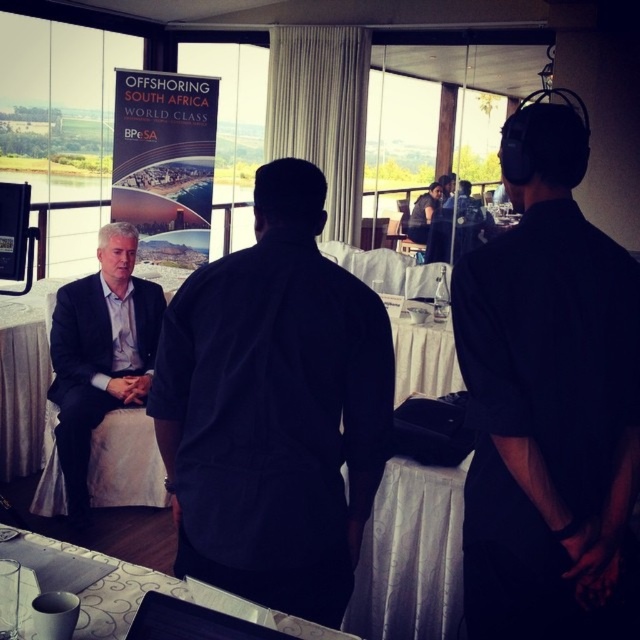
Looking at this image, can you confirm if black short-sleeved shirt at center is smaller than white fabric table at lower center?

Actually, black short-sleeved shirt at center might be larger than white fabric table at lower center.

Is black short-sleeved shirt at center above white fabric table at lower center?

Yes.

Image resolution: width=640 pixels, height=640 pixels. What do you see at coordinates (548, 403) in the screenshot?
I see `black short-sleeved shirt at center` at bounding box center [548, 403].

Locate an element on the screen. This screenshot has width=640, height=640. black short-sleeved shirt at center is located at coordinates (548, 403).

Where is `white fabric table at lower center`? white fabric table at lower center is located at coordinates click(112, 589).

Which of these two, white fabric table at lower center or matte black shirt at center, stands taller?

matte black shirt at center is taller.

Is point (310, 636) closer to camera compared to point (420, 211)?

Yes, it is in front of point (420, 211).

Locate an element on the screen. Image resolution: width=640 pixels, height=640 pixels. white fabric table at lower center is located at coordinates (112, 589).

Does dark blue shirt at center come in front of white fabric table at lower center?

No, it is not.

Does dark blue shirt at center have a smaller size compared to white fabric table at lower center?

No.

Which is in front, point (276, 449) or point (317, 637)?

Point (317, 637) is in front.

You are a GUI agent. You are given a task and a screenshot of the screen. Output one action in this format:
    pyautogui.click(x=<x>, y=<y>)
    Task: Click on the dark blue shirt at center
    This screenshot has width=640, height=640.
    Given the screenshot: What is the action you would take?
    pyautogui.click(x=275, y=408)